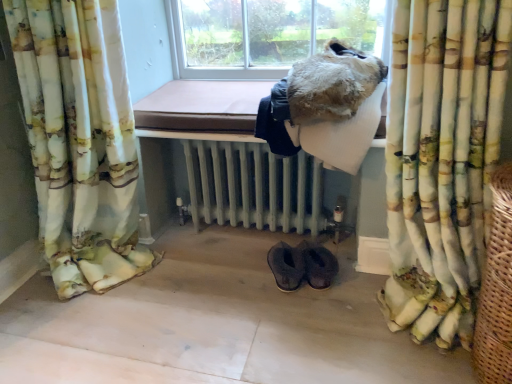
The width and height of the screenshot is (512, 384). What are the coordinates of `blank space to the left of printed fabric curtain at right, which is counted as the first curtain, starting from the right` in the screenshot? It's located at (317, 331).